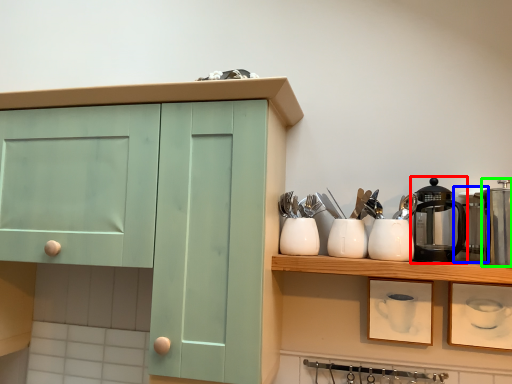
Question: Considering the real-world distances, which object is closest to coffeepot (highlighted by a red box)? appliance (highlighted by a blue box) or appliance (highlighted by a green box).

Choices:
 (A) appliance
 (B) appliance

Answer: (A)